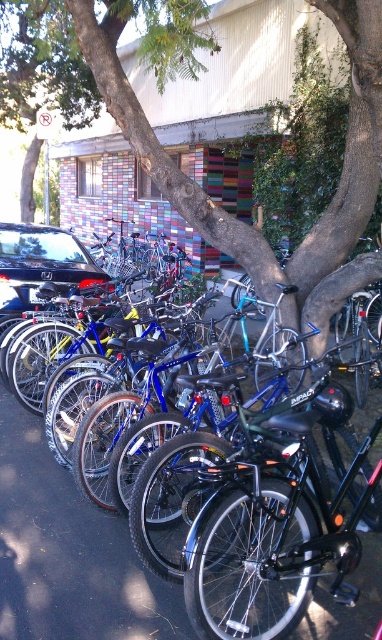
You are a pedestrian standing on the black rubber pavement at center and want to cross the street to reach a store on the other side. Is the glossy black car at left blocking your path?

The black rubber pavement at center is to the right of the glossy black car at left, so the car is positioned to the left of the pavement. Since you are on the pavement, the car is not directly blocking your path to cross the street.

You are a pedestrian standing in the middle of the street. You see the smooth bark tree at center and the glossy black car at left. Which object is nearer to you?

The smooth bark tree at center is closer to the viewer than the glossy black car at left, so the smooth bark tree at center is nearer to you.

In the scene shown: You are a city planner designing a new bike parking area. You want to ensure there is enough space between the smooth bark tree at center and the nearest bicycle. What is the minimum distance you should maintain between them?

The minimum distance you should maintain between the smooth bark tree at center and the nearest bicycle is 12.38 feet.